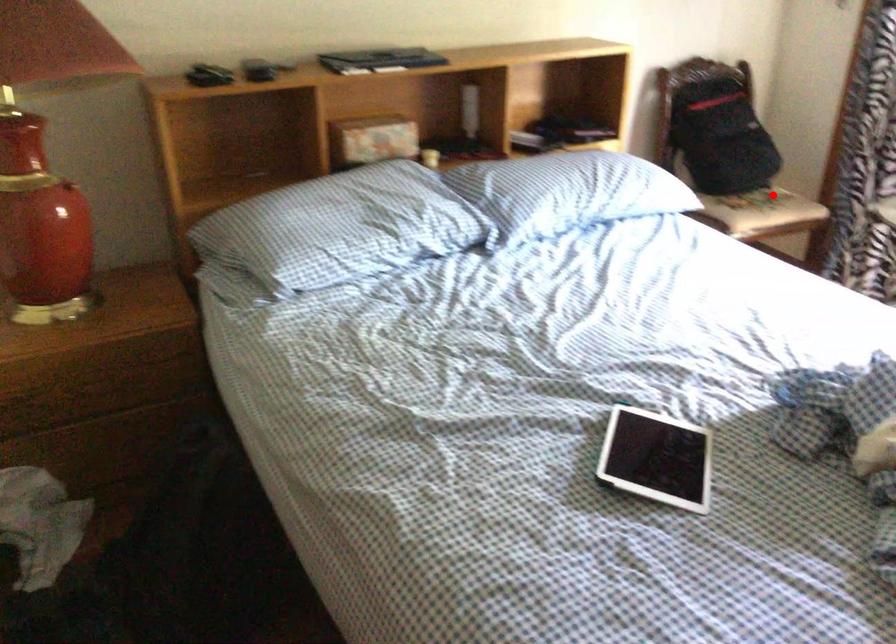
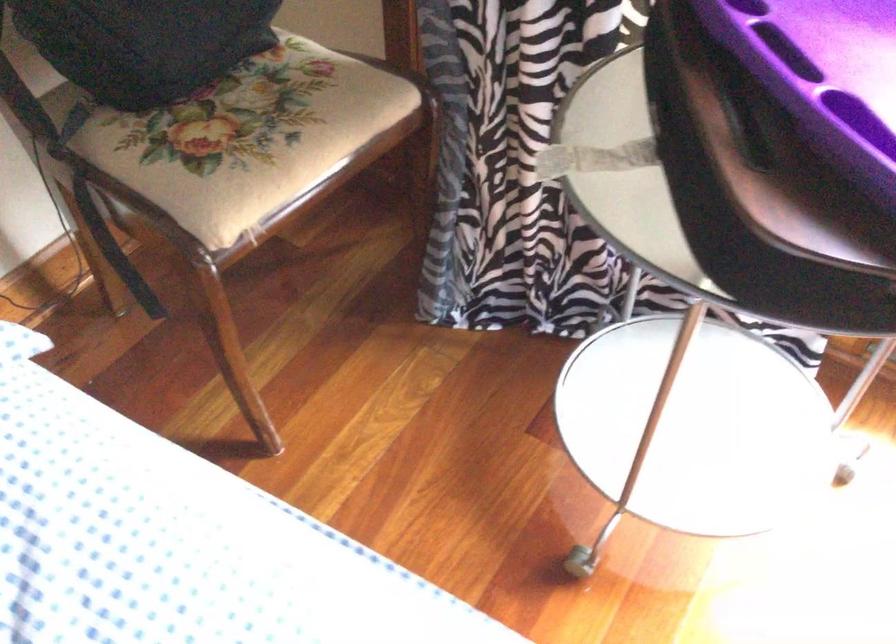
Question: I am providing you with two images of the same scene from different viewpoints. Image1 has a red point marked. In image2, the corresponding 3D location appears at what relative position? Reply with the corresponding letter.

Choices:
 (A) Closer
 (B) Farther

Answer: (A)